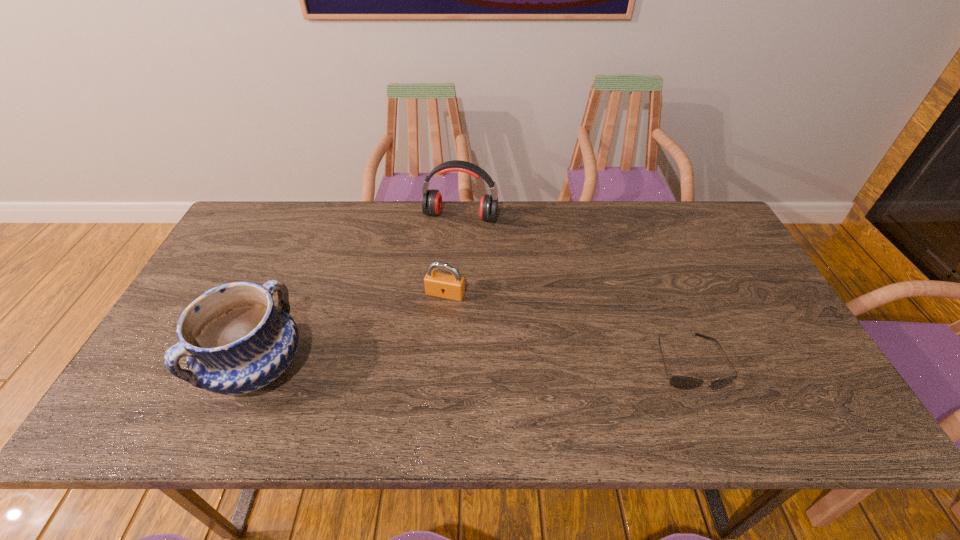
Identify the location of free point at the right edge. The image size is (960, 540). (730, 268).

Find the location of a particular element. This screenshot has height=540, width=960. free space at the far left corner of the desktop is located at coordinates (289, 202).

This screenshot has width=960, height=540. In order to click on vacant region at the far right corner of the desktop in this screenshot , I will do `click(712, 245)`.

Locate an element on the screen. The height and width of the screenshot is (540, 960). vacant area between the farthest object and the second shortest object is located at coordinates (453, 255).

At what (x,y) coordinates should I click in order to perform the action: click on vacant area that lies between the sunglasses and the leftmost object. Please return your answer as a coordinate pair (x, y). This screenshot has height=540, width=960. Looking at the image, I should click on (473, 364).

You are a GUI agent. You are given a task and a screenshot of the screen. Output one action in this format:
    pyautogui.click(x=<x>, y=<y>)
    Task: Click on the empty space that is in between the padlock and the farthest object
    
    Given the screenshot: What is the action you would take?
    pyautogui.click(x=453, y=255)

Where is `unoccupied position between the second farthest object and the sunglasses`? This screenshot has height=540, width=960. unoccupied position between the second farthest object and the sunglasses is located at coordinates (566, 328).

Find the location of a particular element. This screenshot has width=960, height=540. free area in between the second shortest object and the pottery is located at coordinates (351, 330).

Find the location of a particular element. The width and height of the screenshot is (960, 540). free space between the shortest object and the leftmost object is located at coordinates (473, 364).

At what (x,y) coordinates should I click in order to perform the action: click on unoccupied position between the farthest object and the leftmost object. Please return your answer as a coordinate pair (x, y). The width and height of the screenshot is (960, 540). Looking at the image, I should click on (359, 291).